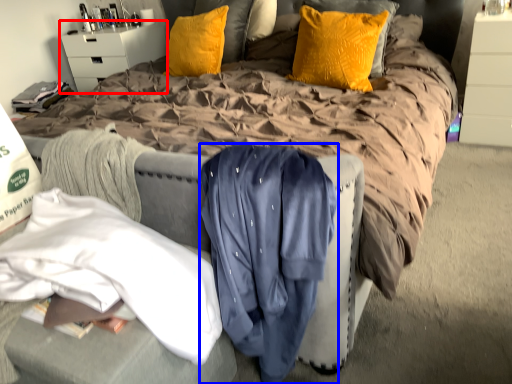
Question: Which point is further to the camera, nightstand (highlighted by a red box) or clothing (highlighted by a blue box)?

Choices:
 (A) nightstand
 (B) clothing

Answer: (A)